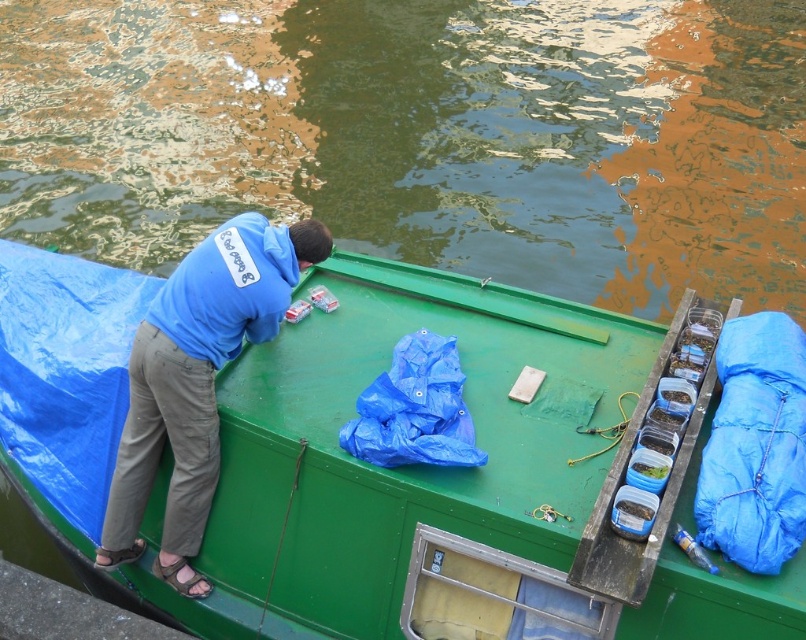
You are standing on the dock and looking at the boat. There is a point marked at coordinates (422,134). What is located at that point?

The point at coordinates (422,134) is occupied by green water at upper center.

You are a photographer trying to capture the scene of the green water at upper center and the blue cotton hoodie at upper left. Which object would you need to adjust your camera focus for first if you want both to be in focus, considering their sizes?

The green water at upper center has a larger size compared to the blue cotton hoodie at upper left, so you should focus on the green water at upper center first to ensure both are in focus.